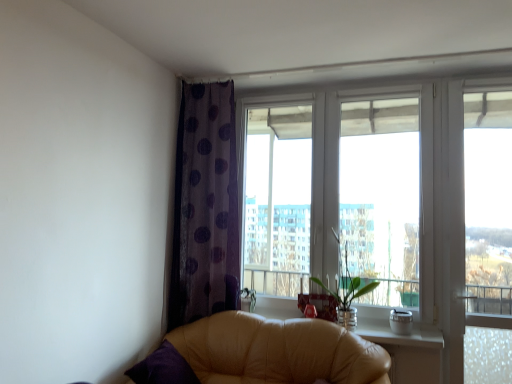
Question: Are transparent plastic screen at right and green glass vase at center located far from each other?

Choices:
 (A) no
 (B) yes

Answer: (A)

Question: Can you confirm if transparent plastic screen at right is taller than green glass vase at center?

Choices:
 (A) no
 (B) yes

Answer: (B)

Question: Can you confirm if transparent plastic screen at right is wider than green glass vase at center?

Choices:
 (A) no
 (B) yes

Answer: (A)

Question: Does transparent plastic screen at right contain green glass vase at center?

Choices:
 (A) yes
 (B) no

Answer: (B)

Question: Considering the relative sizes of transparent plastic screen at right and green glass vase at center in the image provided, is transparent plastic screen at right shorter than green glass vase at center?

Choices:
 (A) no
 (B) yes

Answer: (A)

Question: From a real-world perspective, is transparent plastic screen at right under green glass vase at center?

Choices:
 (A) yes
 (B) no

Answer: (B)

Question: Is transparent plastic screen at right inside green glass vase at center?

Choices:
 (A) yes
 (B) no

Answer: (B)

Question: Is green glass vase at center directly adjacent to transparent plastic screen at right?

Choices:
 (A) yes
 (B) no

Answer: (B)

Question: Is green glass vase at center smaller than transparent plastic screen at right?

Choices:
 (A) yes
 (B) no

Answer: (B)

Question: Is green glass vase at center to the right of transparent plastic screen at right from the viewer's perspective?

Choices:
 (A) no
 (B) yes

Answer: (A)

Question: Is green glass vase at center taller than transparent plastic screen at right?

Choices:
 (A) yes
 (B) no

Answer: (B)

Question: Does green glass vase at center have a larger size compared to transparent plastic screen at right?

Choices:
 (A) no
 (B) yes

Answer: (B)

Question: From a real-world perspective, is purple dotted curtain at left positioned under transparent plastic screen at right based on gravity?

Choices:
 (A) yes
 (B) no

Answer: (B)